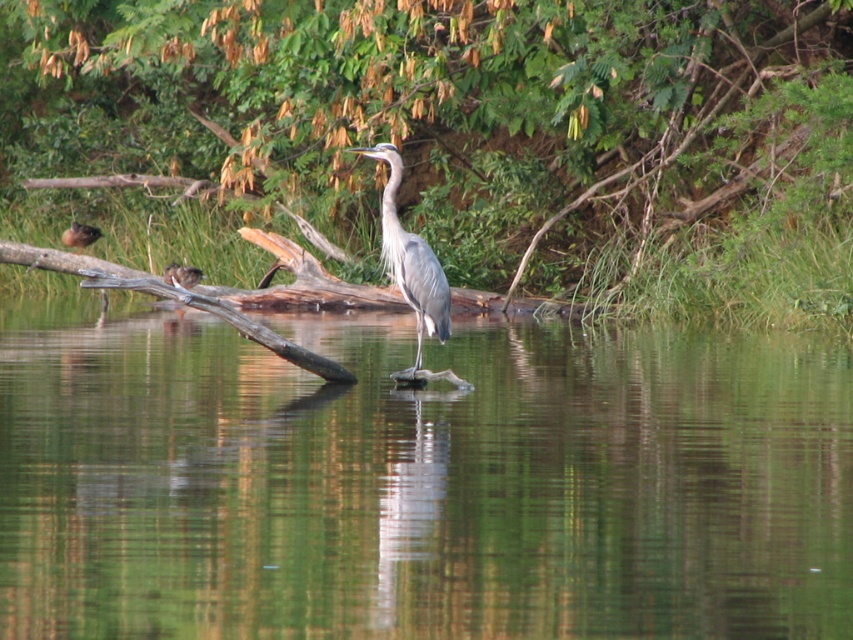
Consider the image. You are a photographer trying to capture the clear water at center and the brown fuzzy duckling at left. Since you want to focus on the water, which object should you adjust your camera to prioritize in terms of depth of field?

The clear water at center should be prioritized in the depth of field because it has a greater height compared to the brown fuzzy duckling at left, making it the main subject.

You are a photographer trying to capture the clear water at center and the green leafy tree at upper center in a single shot. Which object will appear larger in your photo?

The clear water at center will appear larger in the photo because it is closer to the viewer than the green leafy tree at upper center.